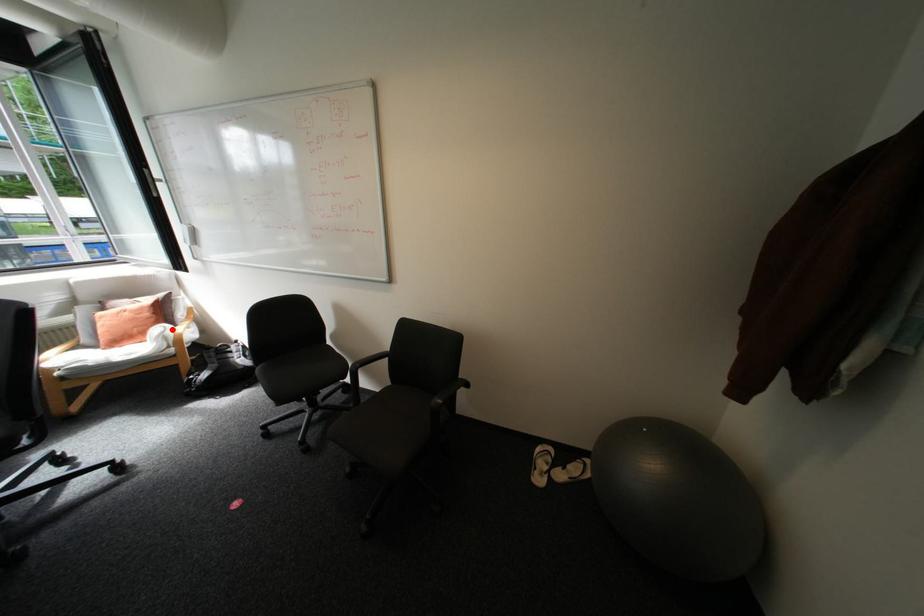
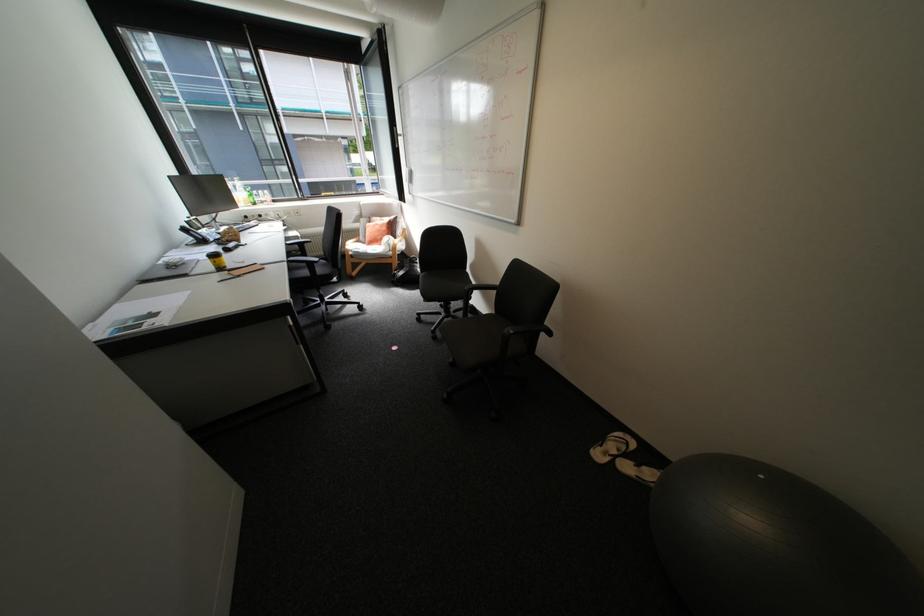
The point at the highlighted location is marked in the first image. Where is the corresponding point in the second image?

(397, 238)